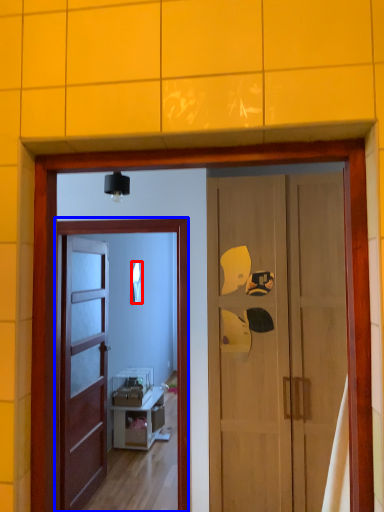
Question: Which point is further to the camera, mirror (highlighted by a red box) or screen door (highlighted by a blue box)?

Choices:
 (A) mirror
 (B) screen door

Answer: (A)